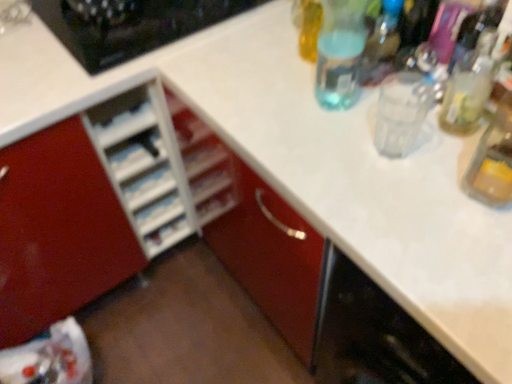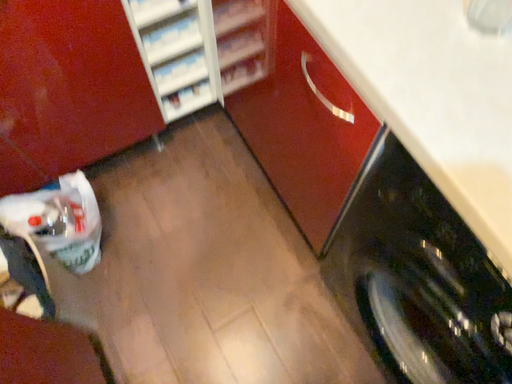
Question: Which way did the camera rotate in the video?

Choices:
 (A) rotated upward
 (B) rotated downward

Answer: (B)